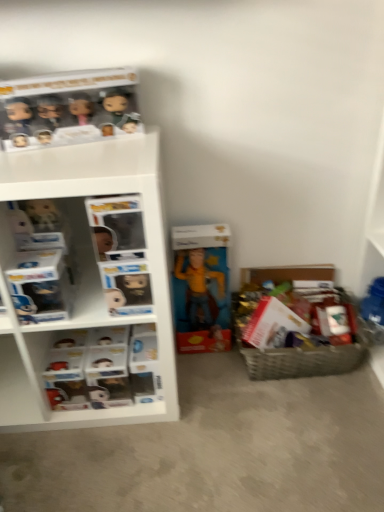
Question: Is white plastic shelves at left surrounded by woven brown basket at lower right?

Choices:
 (A) no
 (B) yes

Answer: (A)

Question: Is woven brown basket at lower right facing towards white plastic shelves at left?

Choices:
 (A) no
 (B) yes

Answer: (A)

Question: Are woven brown basket at lower right and white plastic shelves at left making contact?

Choices:
 (A) yes
 (B) no

Answer: (B)

Question: From the image's perspective, is woven brown basket at lower right on white plastic shelves at left?

Choices:
 (A) no
 (B) yes

Answer: (B)

Question: From the image's perspective, is woven brown basket at lower right under white plastic shelves at left?

Choices:
 (A) yes
 (B) no

Answer: (B)

Question: Is woven brown basket at lower right far away from white plastic shelves at left?

Choices:
 (A) no
 (B) yes

Answer: (A)

Question: Are matte yellow action figure at center and matte black figurines at upper left making contact?

Choices:
 (A) no
 (B) yes

Answer: (A)

Question: Can you confirm if matte yellow action figure at center is shorter than matte black figurines at upper left?

Choices:
 (A) no
 (B) yes

Answer: (A)

Question: From the image's perspective, does matte yellow action figure at center appear higher than matte black figurines at upper left?

Choices:
 (A) no
 (B) yes

Answer: (A)

Question: From a real-world perspective, is matte yellow action figure at center over matte black figurines at upper left?

Choices:
 (A) yes
 (B) no

Answer: (B)

Question: Is matte yellow action figure at center bigger than matte black figurines at upper left?

Choices:
 (A) no
 (B) yes

Answer: (B)

Question: Considering the relative sizes of matte yellow action figure at center and matte black figurines at upper left in the image provided, is matte yellow action figure at center taller than matte black figurines at upper left?

Choices:
 (A) no
 (B) yes

Answer: (B)

Question: From the image's perspective, is matte black figurines at upper left over white plastic shelves at left?

Choices:
 (A) yes
 (B) no

Answer: (A)